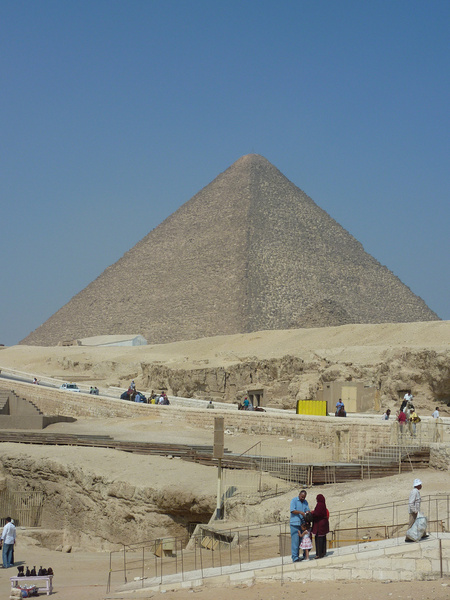
Image resolution: width=450 pixels, height=600 pixels. I want to click on stairs, so click(415, 457), click(400, 448), click(389, 454), click(383, 458), click(371, 463), click(400, 457).